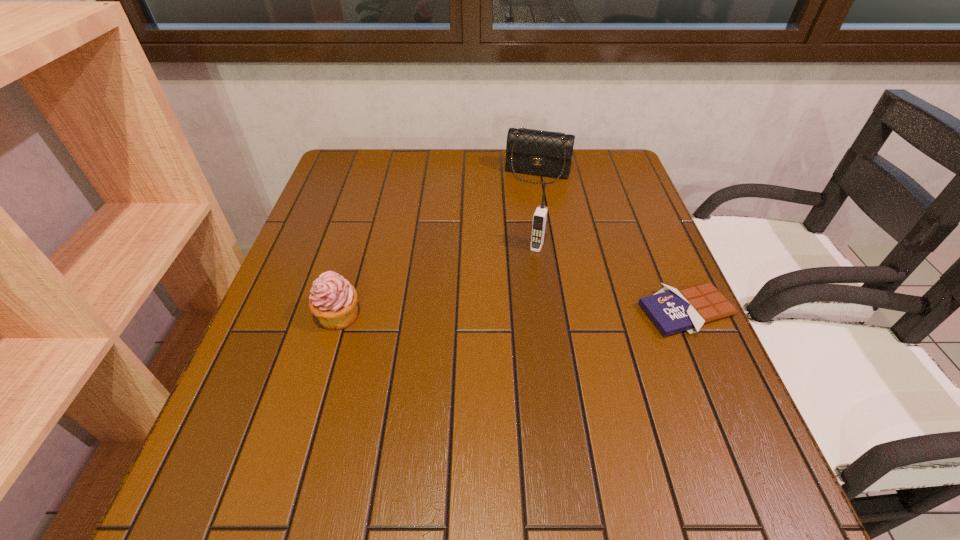
At what (x,y) coordinates should I click in order to perform the action: click on vacant area at the right edge of the desktop. Please return your answer as a coordinate pair (x, y). Looking at the image, I should click on (626, 266).

Where is `vacant space at the far left corner of the desktop`? The width and height of the screenshot is (960, 540). vacant space at the far left corner of the desktop is located at coordinates (346, 184).

The image size is (960, 540). In order to click on free space at the far right corner in this screenshot , I will do `click(580, 163)`.

Locate an element on the screen. empty location between the shortest object and the clutch bag is located at coordinates (612, 242).

Identify the location of unoccupied position between the clutch bag and the shortest object. (612, 242).

Identify the location of free space between the shortest object and the cupcake. Image resolution: width=960 pixels, height=540 pixels. point(513,314).

Identify the location of vacant space that is in between the clutch bag and the cupcake. tap(438, 244).

Image resolution: width=960 pixels, height=540 pixels. Identify the location of free space between the clutch bag and the cupcake. click(438, 244).

You are a GUI agent. You are given a task and a screenshot of the screen. Output one action in this format:
    pyautogui.click(x=<x>, y=<y>)
    Task: Click on the free space between the shortest object and the second farthest object
    
    Given the screenshot: What is the action you would take?
    pyautogui.click(x=612, y=279)

Where is `vacant space that's between the clutch bag and the shortest object`? The height and width of the screenshot is (540, 960). vacant space that's between the clutch bag and the shortest object is located at coordinates (612, 242).